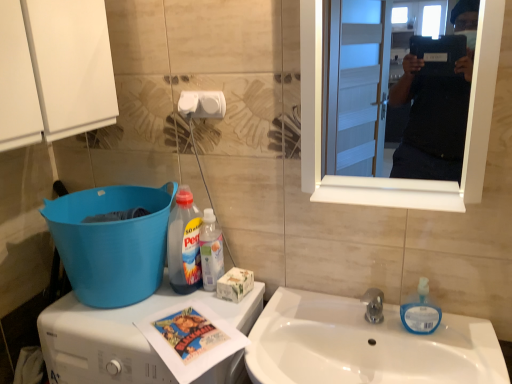
I want to click on free space on the front side of translucent plastic bottle at center, which appears as the 2th bottle when viewed from the left, so click(209, 314).